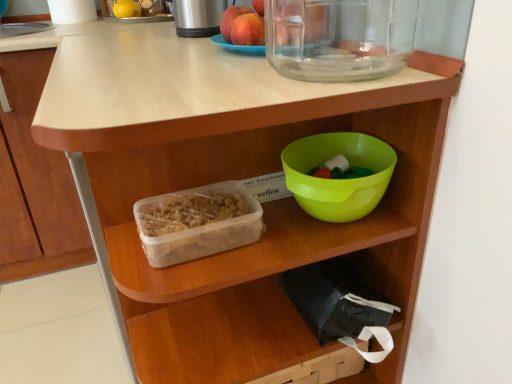
Question: From a real-world perspective, relative to translucent plastic container at center, is brushed metal thermos at upper center vertically above or below?

Choices:
 (A) below
 (B) above

Answer: (B)

Question: Is brushed metal thermos at upper center situated inside translucent plastic container at center or outside?

Choices:
 (A) inside
 (B) outside

Answer: (B)

Question: Which object is the closest to the translucent plastic container at center?

Choices:
 (A) green plastic bowl at center
 (B) matte peach at upper center, the 2th apple in the back-to-front sequence
 (C) smooth peach at upper center, the second apple positioned from the front
 (D) brushed metal thermos at upper center

Answer: (A)

Question: Which of these objects is positioned farthest from the green plastic bowl at center?

Choices:
 (A) brushed metal thermos at upper center
 (B) translucent plastic container at center
 (C) matte peach at upper center, the 1th apple positioned from the front
 (D) smooth peach at upper center, the second apple positioned from the front

Answer: (A)